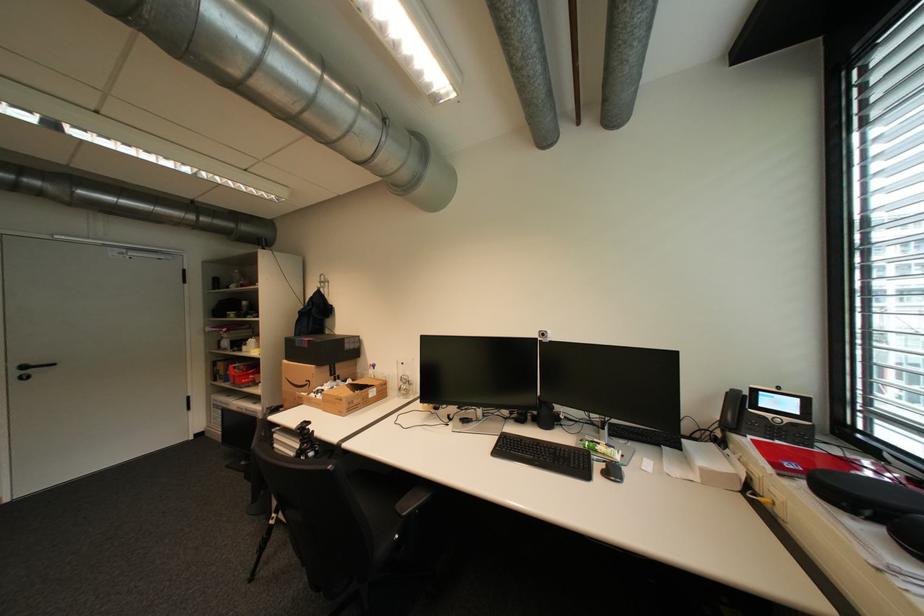
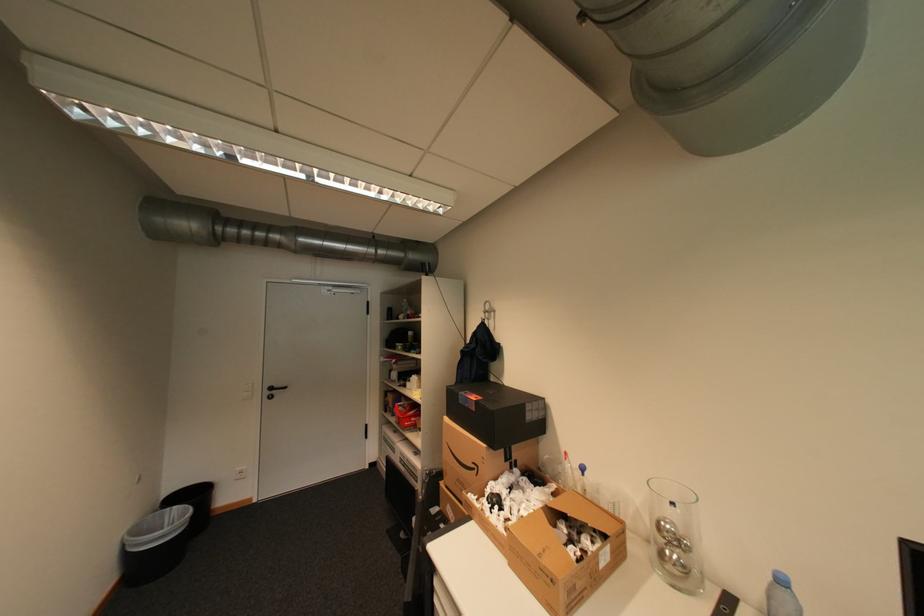
Find the pixel in the second image that matches [233,382] in the first image.

(400, 416)